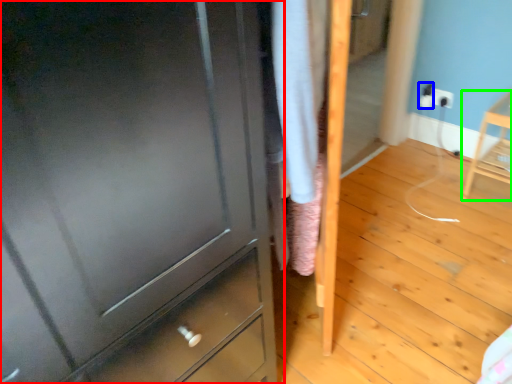
Question: Considering the real-world distances, which object is closest to chest of drawers (highlighted by a red box)? electric outlet (highlighted by a blue box) or furniture (highlighted by a green box).

Choices:
 (A) electric outlet
 (B) furniture

Answer: (B)